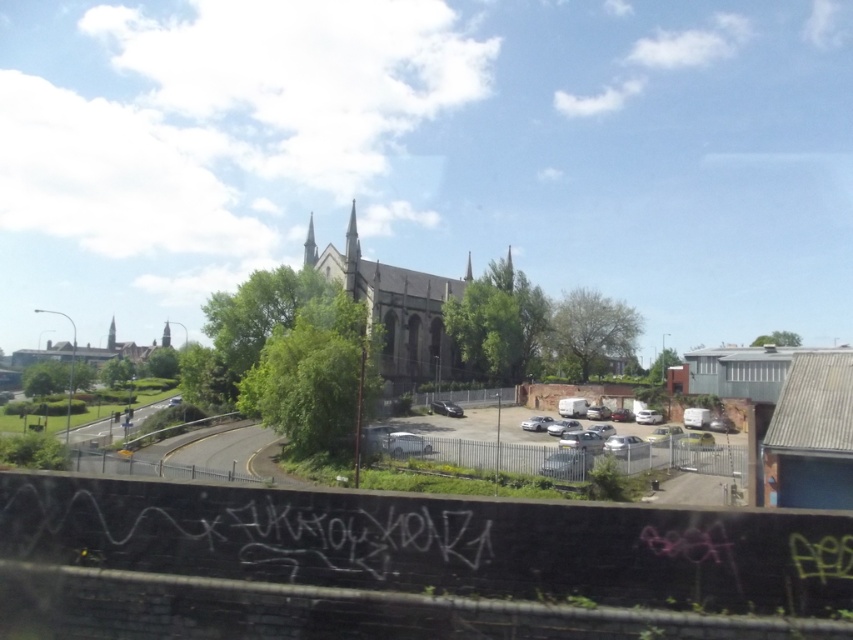
Can you confirm if dark gray stone church at center is shorter than matte gray building at center?

No, dark gray stone church at center is not shorter than matte gray building at center.

Describe the element at coordinates (396, 308) in the screenshot. I see `dark gray stone church at center` at that location.

This screenshot has height=640, width=853. I want to click on dark gray stone church at center, so click(396, 308).